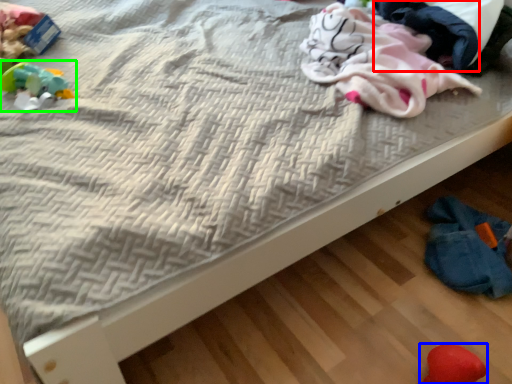
Question: Which is nearer to the clothing (highlighted by a red box)? toy (highlighted by a blue box) or toy (highlighted by a green box).

Choices:
 (A) toy
 (B) toy

Answer: (A)